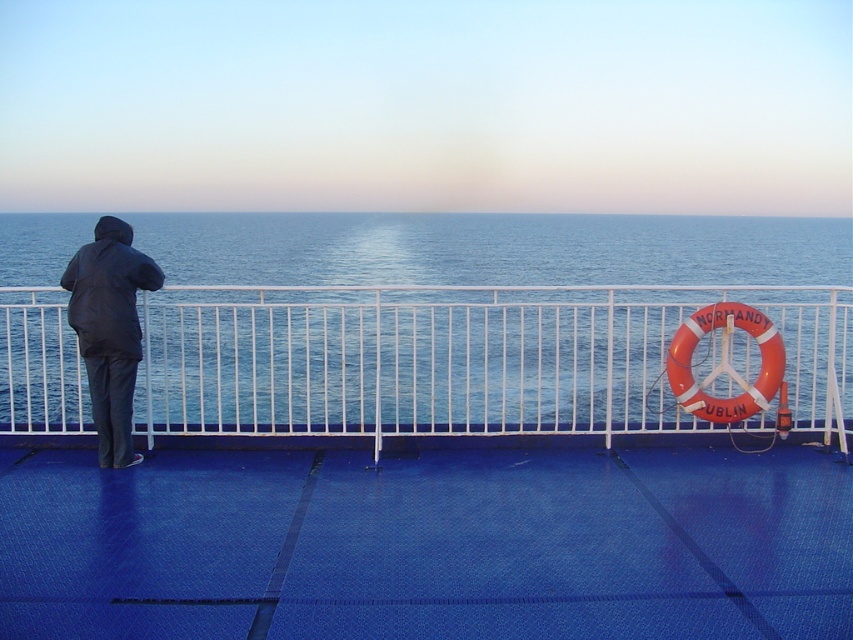
You are standing on the deck of the ferry and want to know if the white metal fence at left can provide enough space to place a small backpack between it and the dark blue fabric jacket at left. Can you determine if there is enough space?

The white metal fence at left is bigger than the dark blue fabric jacket at left, so there is likely enough space to place a small backpack between them.

Based on the photo, you are a photographer trying to capture a wide shot of the scene. The white metal fence at left and dark blue fabric jacket at left are both in the frame. Which object would allow you to include more of the background in your photo without moving the camera?

The white metal fence at left has a larger width than the dark blue fabric jacket at left, so capturing the white metal fence at left would block more background, but since the question asks which allows more background inclusion, the answer is the dark blue fabric jacket at left because it is narrower.

You are standing on the ferry deck and want to walk towards the white metal fence at left. Which direction should you move relative to the blue textured deck at center?

To reach the white metal fence at left from the blue textured deck at center, you should move upward since the blue textured deck at center is located below the white metal fence at left.